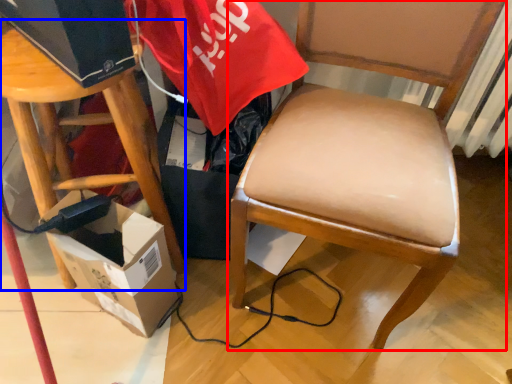
Question: Among these objects, which one is nearest to the camera, chair (highlighted by a red box) or stool (highlighted by a blue box)?

Choices:
 (A) chair
 (B) stool

Answer: (A)